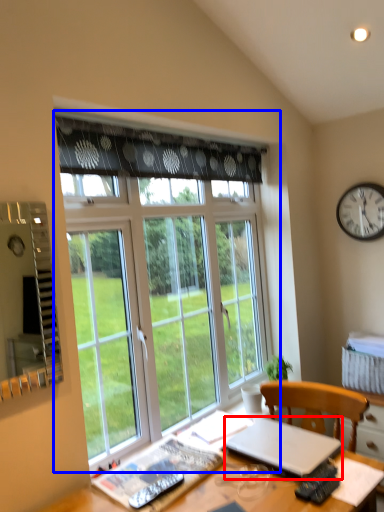
Question: Which object appears farthest to the camera in this image, laptop (highlighted by a red box) or window (highlighted by a blue box)?

Choices:
 (A) laptop
 (B) window

Answer: (B)